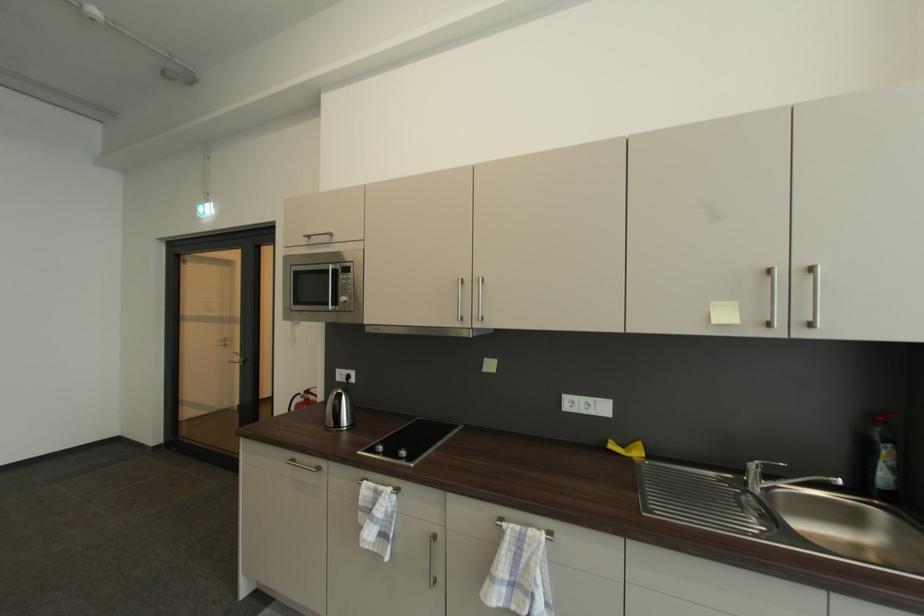
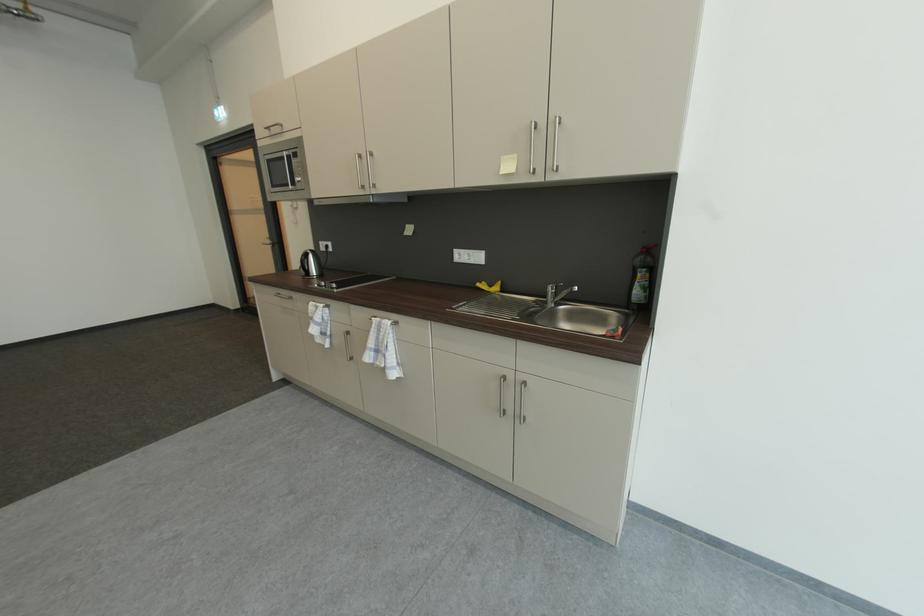
The point at [885,419] is marked in the first image. Where is the corresponding point in the second image?

(650, 252)